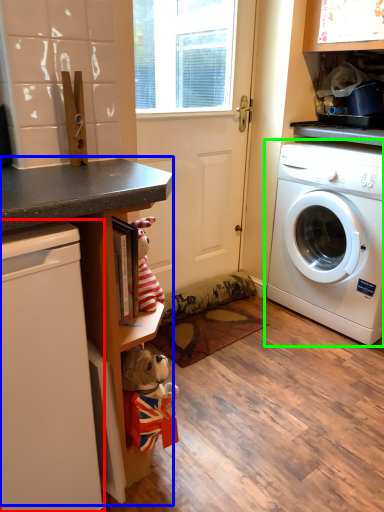
Question: Based on their relative distances, which object is farther from dish washer (highlighted by a red box)? Choose from counter (highlighted by a blue box) and washing machine (highlighted by a green box).

Choices:
 (A) counter
 (B) washing machine

Answer: (B)